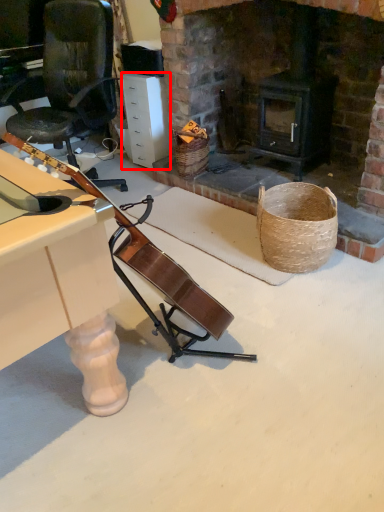
Question: Considering the relative positions of drawer (annotated by the red box) and basket in the image provided, where is drawer (annotated by the red box) located with respect to the staircase?

Choices:
 (A) right
 (B) left

Answer: (B)